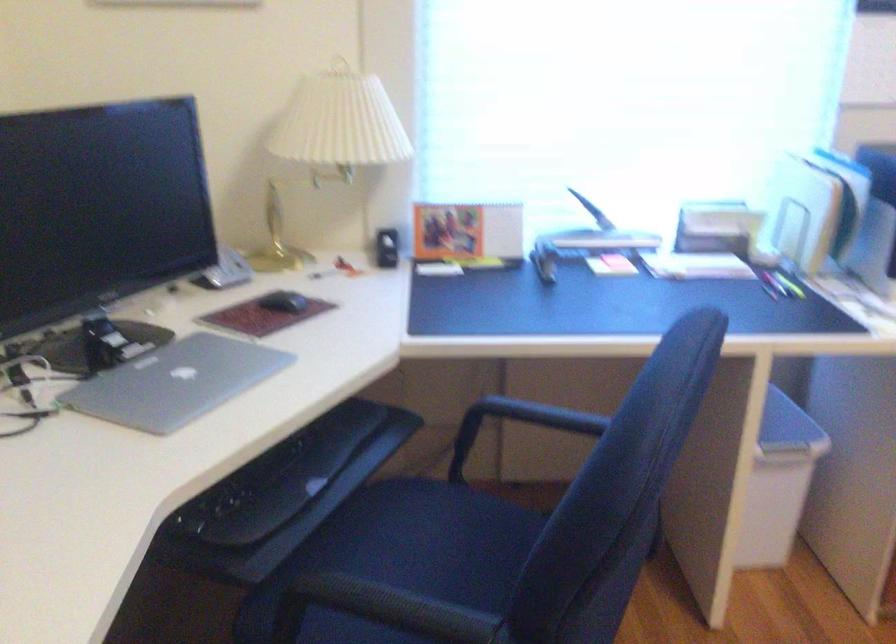
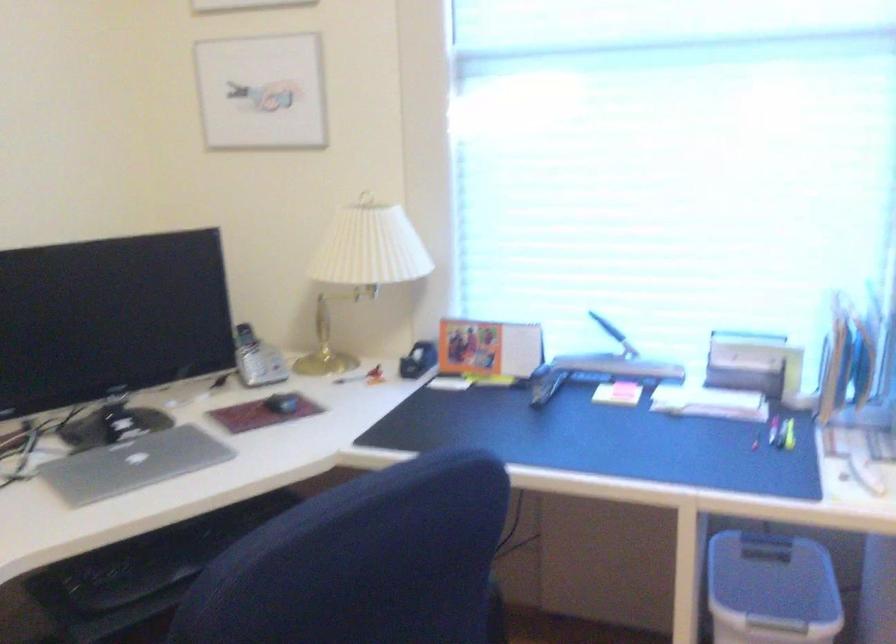
Locate, in the second image, the point that corresponds to (x=181, y=383) in the first image.

(133, 464)